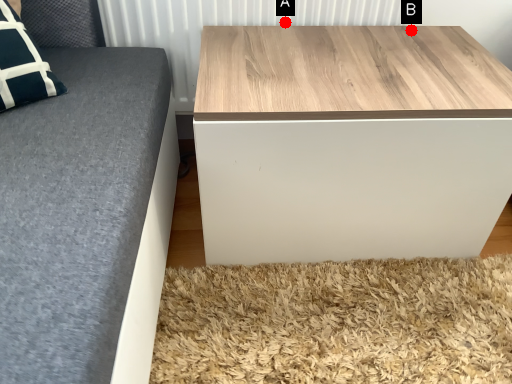
Question: Two points are circled on the image, labeled by A and B beside each circle. Which point is further to the camera?

Choices:
 (A) A is further
 (B) B is further

Answer: (A)